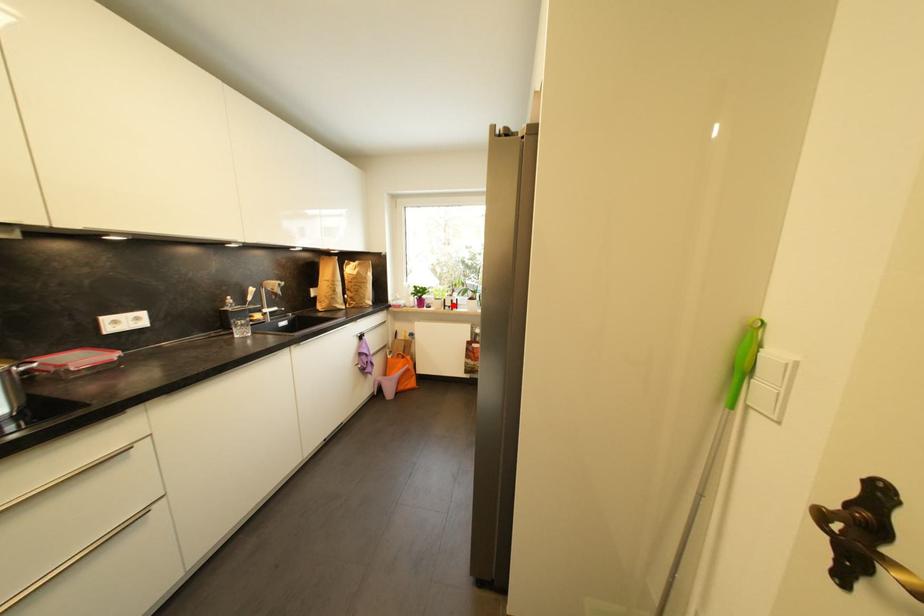
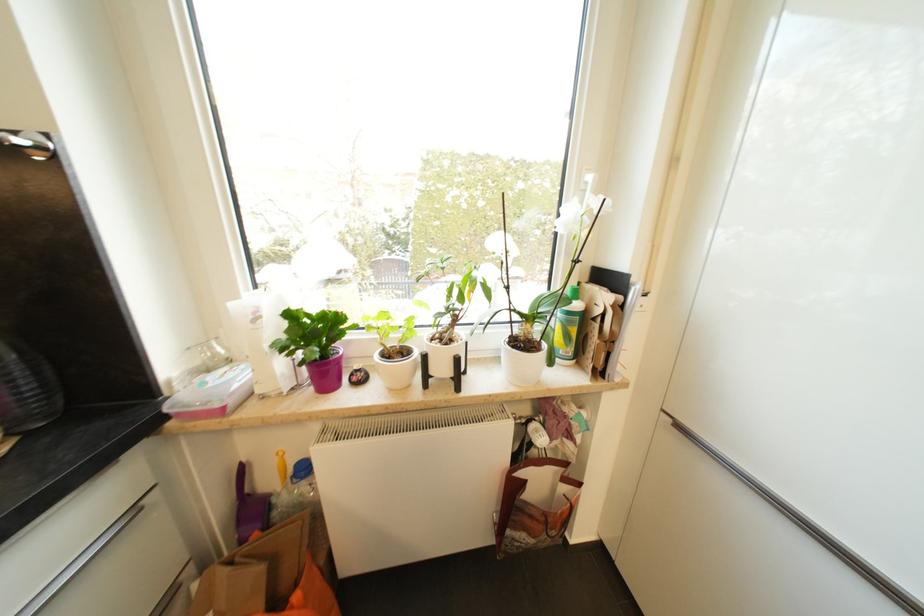
The point at the highlighted location is marked in the first image. Where is the corresponding point in the second image?

(446, 371)